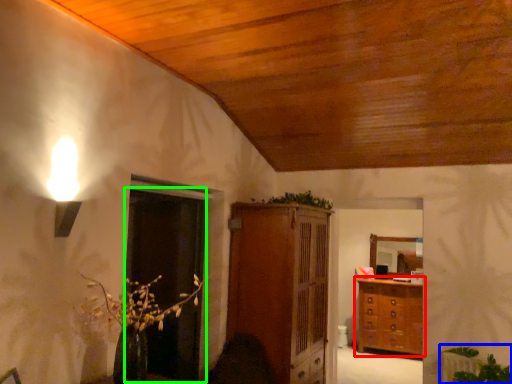
Question: Estimate the real-world distances between objects in this image. Which object is farther from chest of drawers (highlighted by a red box), plant (highlighted by a blue box) or glass door (highlighted by a green box)?

Choices:
 (A) plant
 (B) glass door

Answer: (B)